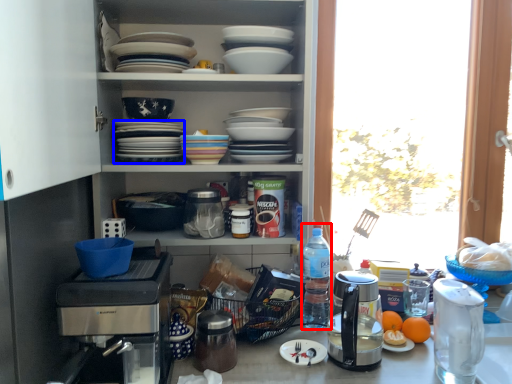
Question: Which object appears farthest to the camera in this image, bottle (highlighted by a red box) or tableware (highlighted by a blue box)?

Choices:
 (A) bottle
 (B) tableware

Answer: (A)